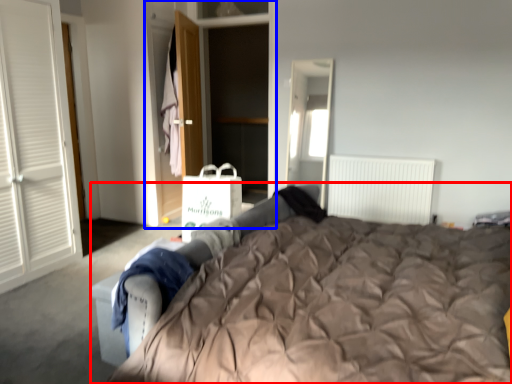
Question: Among these objects, which one is nearest to the camera, bed (highlighted by a red box) or armoire (highlighted by a blue box)?

Choices:
 (A) bed
 (B) armoire

Answer: (A)